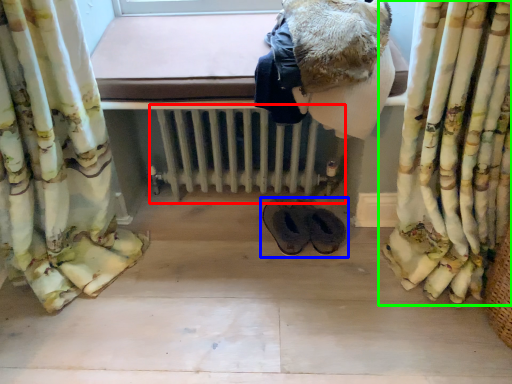
Question: Which object is positioned farthest from radiator (highlighted by a red box)? Select from footwear (highlighted by a blue box) and curtain (highlighted by a green box).

Choices:
 (A) footwear
 (B) curtain

Answer: (B)